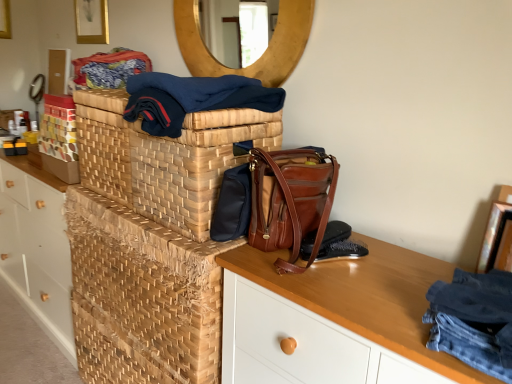
Find the location of a particular element. free space that is to the left of denim jeans at right, which ranks as the first clothing in front-to-back order is located at coordinates (374, 317).